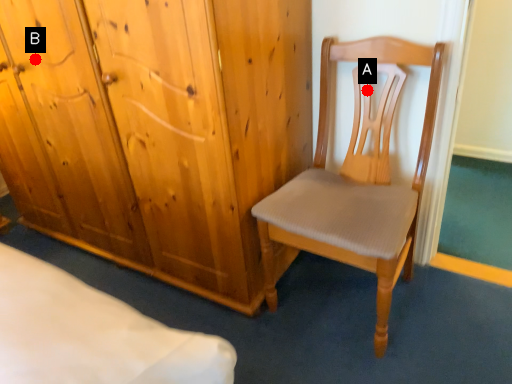
Question: Two points are circled on the image, labeled by A and B beside each circle. Which point is further to the camera?

Choices:
 (A) A is further
 (B) B is further

Answer: (B)